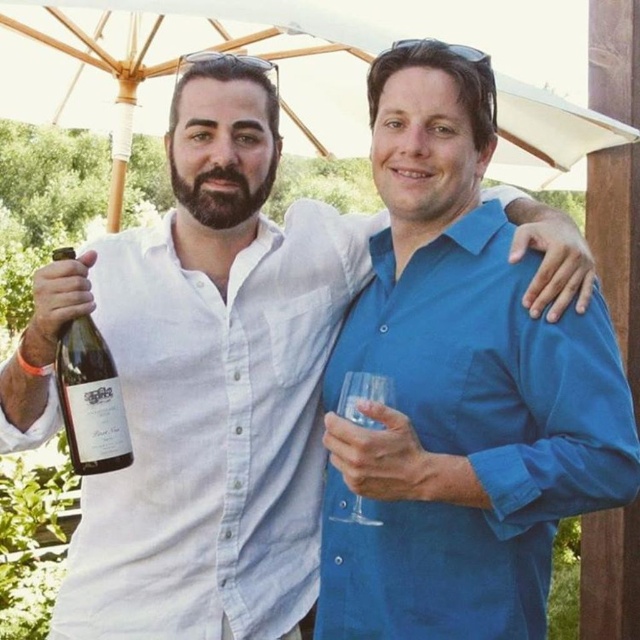
Question: Is blue cotton shirt at center thinner than transparent glass at right?

Choices:
 (A) yes
 (B) no

Answer: (B)

Question: Among these objects, which one is farthest from the camera?

Choices:
 (A) transparent glass at right
 (B) translucent glass bottle at left
 (C) blue cotton shirt at center

Answer: (B)

Question: Based on their relative distances, which object is farther from the translucent glass bottle at left?

Choices:
 (A) transparent glass at right
 (B) blue cotton shirt at center

Answer: (B)

Question: Which is nearer to the blue cotton shirt at center?

Choices:
 (A) transparent glass at right
 (B) white fabric umbrella at upper center
 (C) translucent glass bottle at left

Answer: (A)

Question: Does blue cotton shirt at center have a lesser width compared to translucent glass bottle at left?

Choices:
 (A) no
 (B) yes

Answer: (A)

Question: Does blue cotton shirt at center appear under white fabric umbrella at upper center?

Choices:
 (A) no
 (B) yes

Answer: (B)